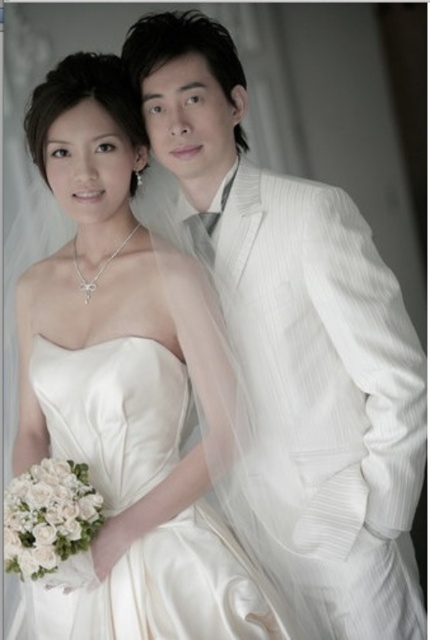
Which is more to the left, white pinstripe suit at center or satin dress at center?

satin dress at center is more to the left.

Does point (366, 260) come behind point (227, 593)?

That is True.

Describe the element at coordinates (298, 339) in the screenshot. I see `white pinstripe suit at center` at that location.

Where is `white pinstripe suit at center`? The width and height of the screenshot is (430, 640). white pinstripe suit at center is located at coordinates (298, 339).